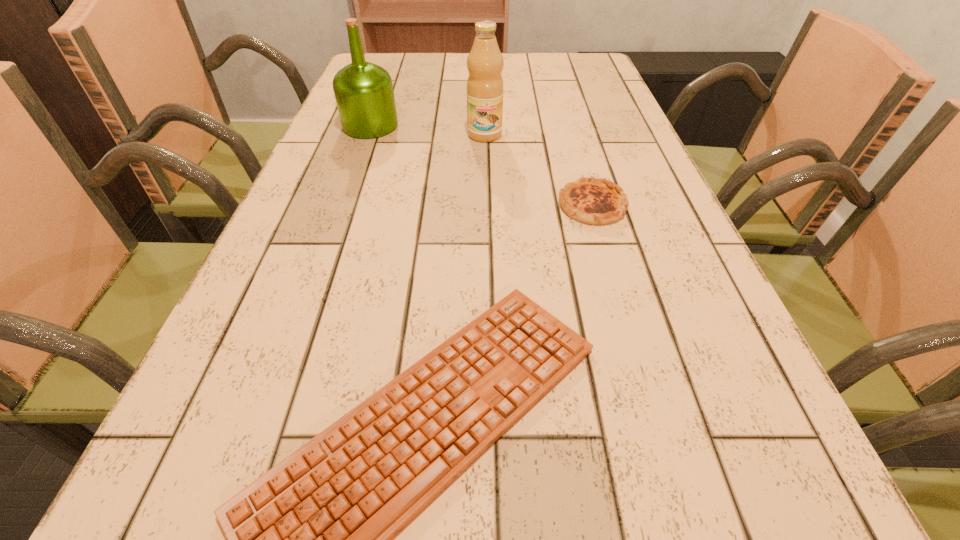
At what (x,y) coordinates should I click in order to perform the action: click on the right olive oil. Please return your answer as a coordinate pair (x, y). The height and width of the screenshot is (540, 960). Looking at the image, I should click on (485, 63).

I want to click on the left olive oil, so click(364, 94).

Find the location of a particular element. Image resolution: width=960 pixels, height=540 pixels. the second shortest object is located at coordinates (591, 200).

The image size is (960, 540). Identify the location of quiche. coord(591,200).

Find the location of a particular element. free space located on the label of the right olive oil is located at coordinates (486, 185).

Locate an element on the screen. This screenshot has height=540, width=960. free location located 0.110m on the back of the left olive oil is located at coordinates [x=381, y=95].

This screenshot has width=960, height=540. I want to click on vacant space located 0.160m on the left of the second nearest object, so click(x=477, y=205).

This screenshot has width=960, height=540. I want to click on object present at the left edge, so click(364, 94).

The image size is (960, 540). In order to click on object situated at the right edge in this screenshot , I will do `click(591, 200)`.

Find the location of a particular element. The width and height of the screenshot is (960, 540). vacant space at the far edge is located at coordinates (429, 75).